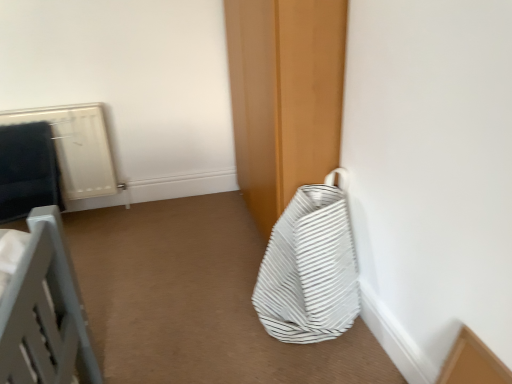
This screenshot has height=384, width=512. What do you see at coordinates (310, 268) in the screenshot? I see `white striped fabric shopping bag at lower right` at bounding box center [310, 268].

Where is `white striped fabric shopping bag at lower right`? white striped fabric shopping bag at lower right is located at coordinates (310, 268).

Locate an element on the screen. white striped fabric shopping bag at lower right is located at coordinates (310, 268).